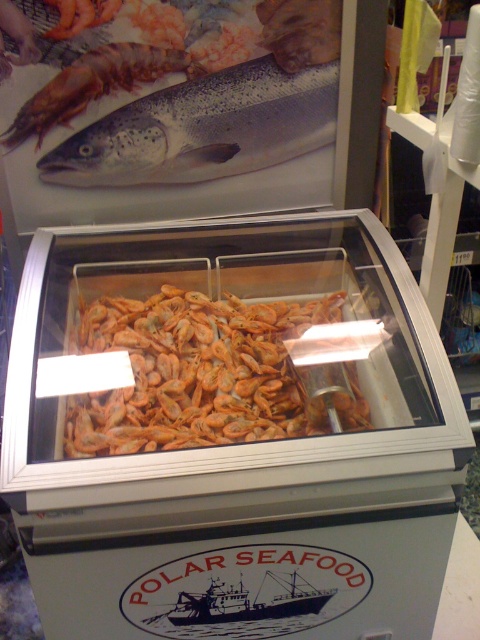
Does point (271, 120) come in front of point (122, 52)?

No.

Which is more to the right, shiny silver fish at upper center or shiny orange prawn at upper left?

shiny silver fish at upper center is more to the right.

Does point (184, 90) come behind point (82, 74)?

Yes.

You are a GUI agent. You are given a task and a screenshot of the screen. Output one action in this format:
    pyautogui.click(x=<x>, y=<y>)
    Task: Click on the shiny silver fish at upper center
    This screenshot has width=480, height=640.
    Given the screenshot: What is the action you would take?
    pyautogui.click(x=203, y=129)

Is orange matte prawns at center positioned at the back of shiny silver fish at upper center?

No, orange matte prawns at center is in front of shiny silver fish at upper center.

Is point (263, 305) positioned before point (103, 150)?

Yes, point (263, 305) is in front of point (103, 150).

Identify the location of orange matte prawns at center. This screenshot has height=640, width=480. (205, 374).

Find the location of a particular element. This screenshot has width=480, height=640. orange matte prawns at center is located at coordinates (205, 374).

Does orange matte prawns at center appear over shiny orange prawn at upper left?

No, orange matte prawns at center is not above shiny orange prawn at upper left.

The height and width of the screenshot is (640, 480). Describe the element at coordinates (205, 374) in the screenshot. I see `orange matte prawns at center` at that location.

I want to click on orange matte prawns at center, so coord(205,374).